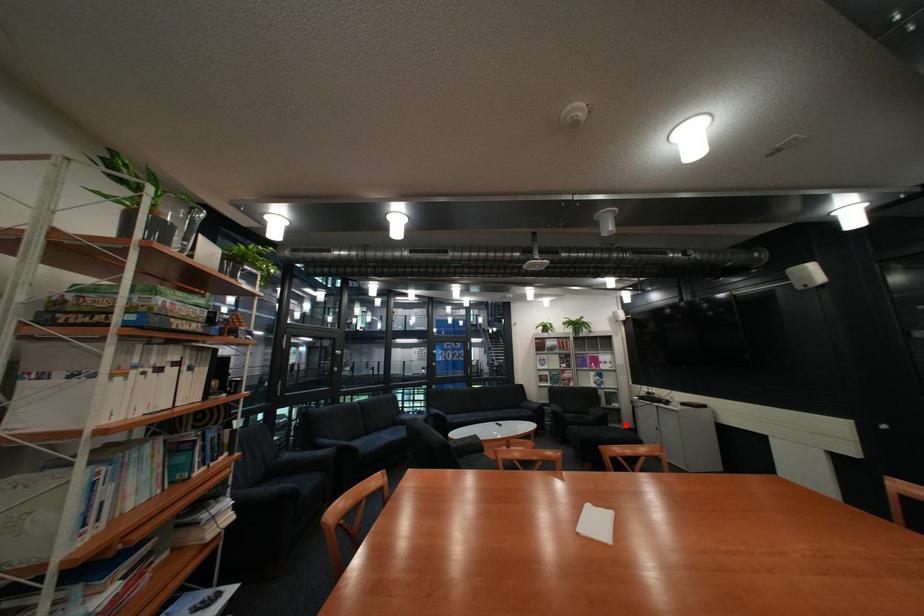
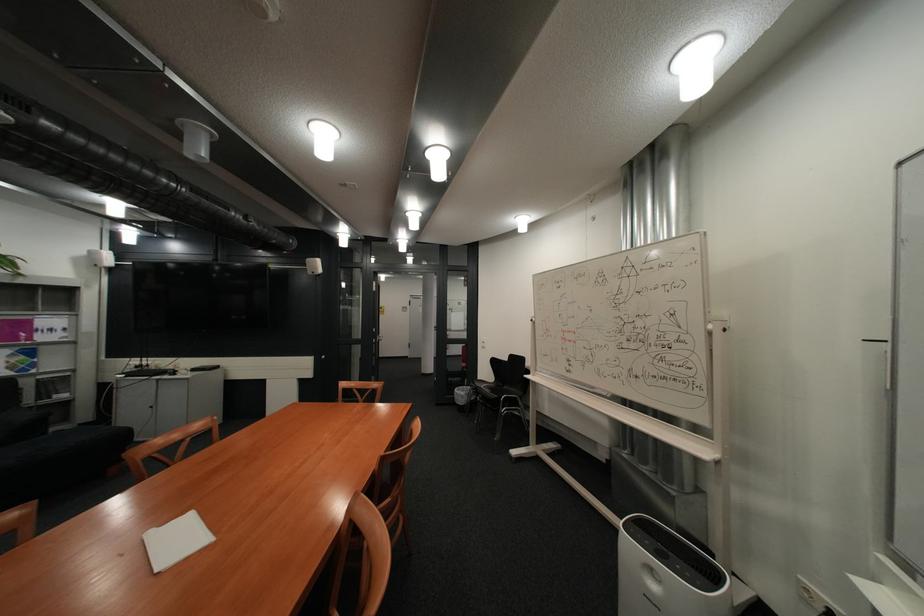
The point at the highlighted location is marked in the first image. Where is the corresponding point in the second image?

(68, 430)